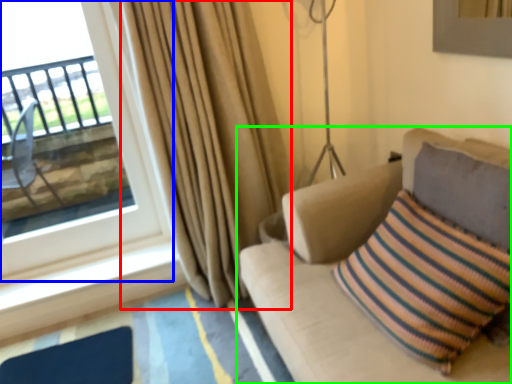
Question: Based on their relative distances, which object is nearer to curtain (highlighted by a red box)? Choose from window (highlighted by a blue box) and studio couch (highlighted by a green box).

Choices:
 (A) window
 (B) studio couch

Answer: (A)